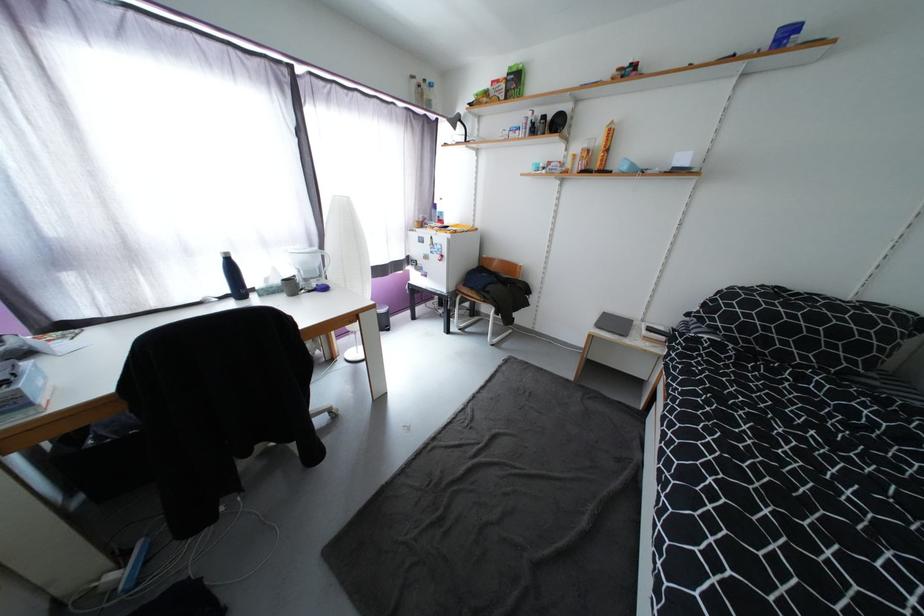
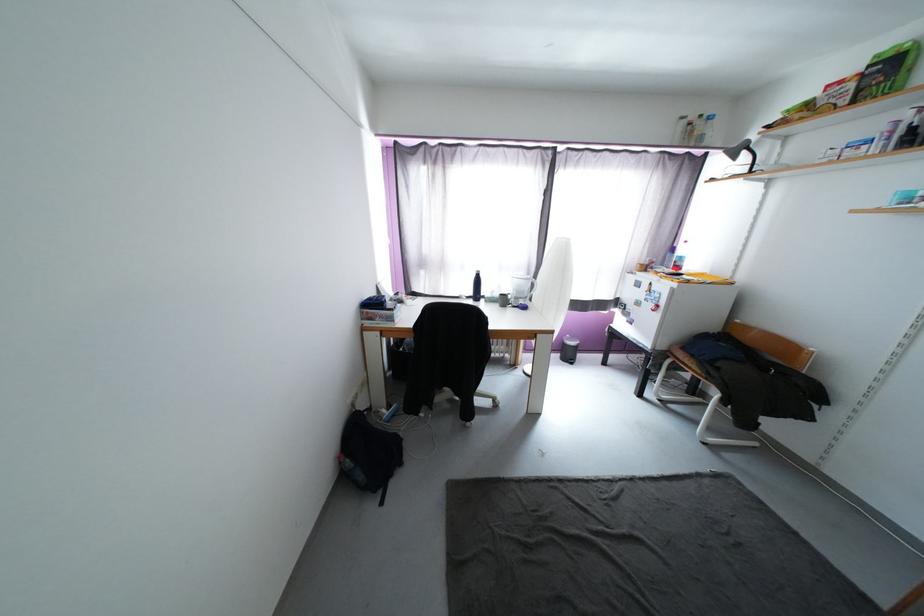
Locate, in the second image, the point that corresponds to (x=311, y=282) in the first image.

(521, 300)